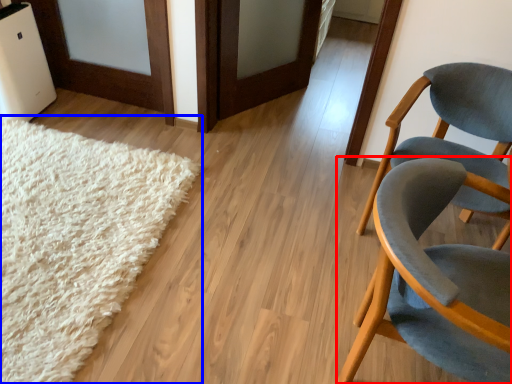
Question: Which object appears closest to the camera in this image, chair (highlighted by a red box) or mat (highlighted by a blue box)?

Choices:
 (A) chair
 (B) mat

Answer: (A)